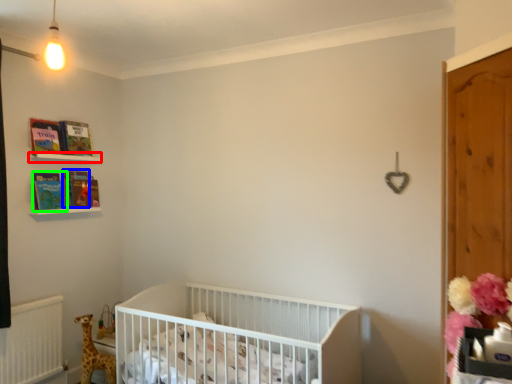
Question: Which is farther away from balustrade (highlighted by a red box)? magazine (highlighted by a blue box) or book (highlighted by a green box)?

Choices:
 (A) magazine
 (B) book

Answer: (B)